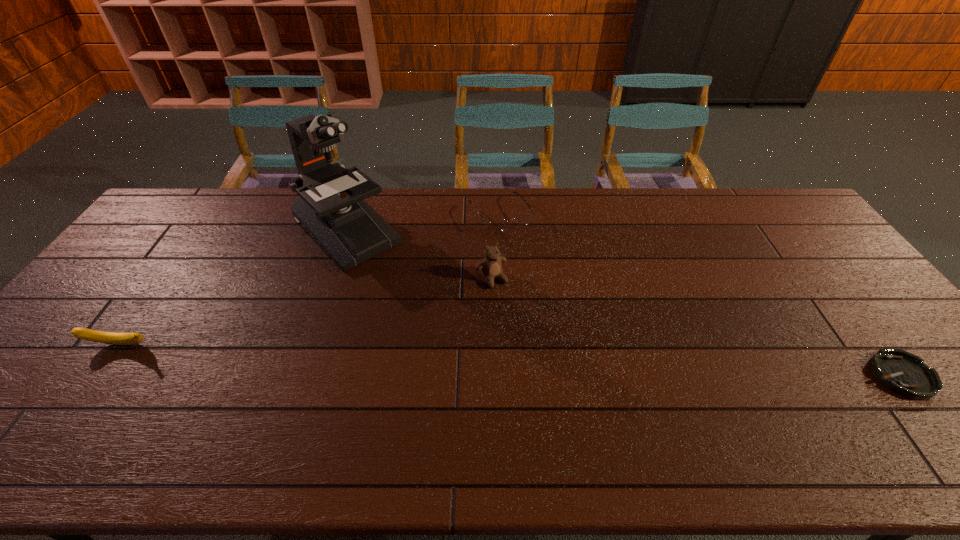
You are a GUI agent. You are given a task and a screenshot of the screen. Output one action in this format:
    pyautogui.click(x=<x>, y=<y>)
    Task: Click on the object that is the closest one to the fourth object from right to left
    The width and height of the screenshot is (960, 540).
    Given the screenshot: What is the action you would take?
    pyautogui.click(x=496, y=226)

At what (x,y) coordinates should I click in order to perform the action: click on object that is the fourth closest one to the tallest object. Please return your answer as a coordinate pair (x, y). Looking at the image, I should click on (904, 373).

The image size is (960, 540). What are the coordinates of `vacant space that satisfies the following two spatial constraints: 1. at the stem of the banana; 2. on the right side of the ashtray` in the screenshot? It's located at (97, 375).